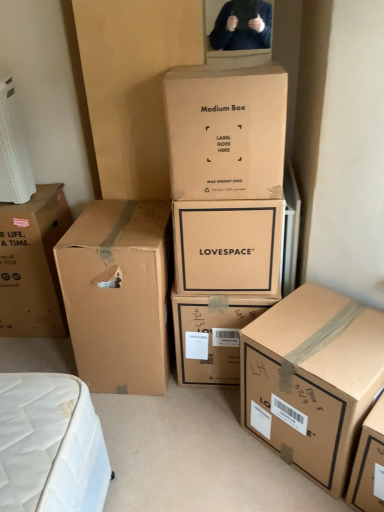
Question: Considering the positions of brown cardboard box at left, arranged as the 2th box when viewed from the left, and brown cardboard box at left, which is the first box from left to right, in the image, is brown cardboard box at left, arranged as the 2th box when viewed from the left, wider or thinner than brown cardboard box at left, which is the first box from left to right,?

Choices:
 (A) thin
 (B) wide

Answer: (B)

Question: Considering their positions, is brown cardboard box at left, arranged as the fifth box when viewed from the right, located in front of or behind brown cardboard box at left, the sixth box viewed from the right?

Choices:
 (A) behind
 (B) front

Answer: (B)

Question: Based on their relative distances, which object is farther from the brown cardboard box at left, which is the first box from left to right?

Choices:
 (A) brown cardboard box at left, arranged as the 2th box when viewed from the left
 (B) brown cardboard box at center, the 4th box in the right-to-left sequence
 (C) matte brown box at center, the second box positioned from the right
 (D) matte cardboard box at center, the 4th box viewed from the left
 (E) brown cardboard box at lower right, the 6th box from the left

Answer: (E)

Question: Estimate the real-world distances between objects in this image. Which object is farther from the brown cardboard box at left, the sixth box viewed from the right?

Choices:
 (A) brown cardboard box at lower right, the 1th box from the right
 (B) matte cardboard box at center, positioned as the third box in right-to-left order
 (C) brown cardboard box at left, arranged as the fifth box when viewed from the right
 (D) matte brown box at center, which is the 5th box in left-to-right order
 (E) brown cardboard box at center, the 4th box in the right-to-left sequence

Answer: (A)